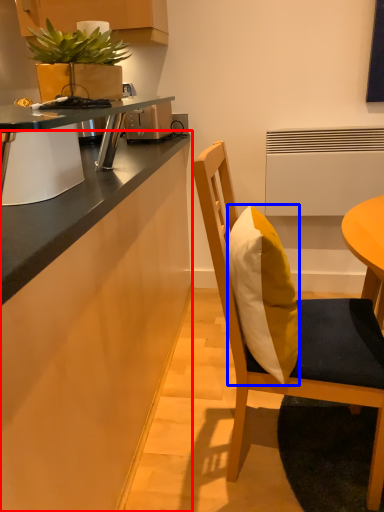
Question: Which object is closer to the camera taking this photo, cabinetry (highlighted by a red box) or pillow (highlighted by a blue box)?

Choices:
 (A) cabinetry
 (B) pillow

Answer: (A)